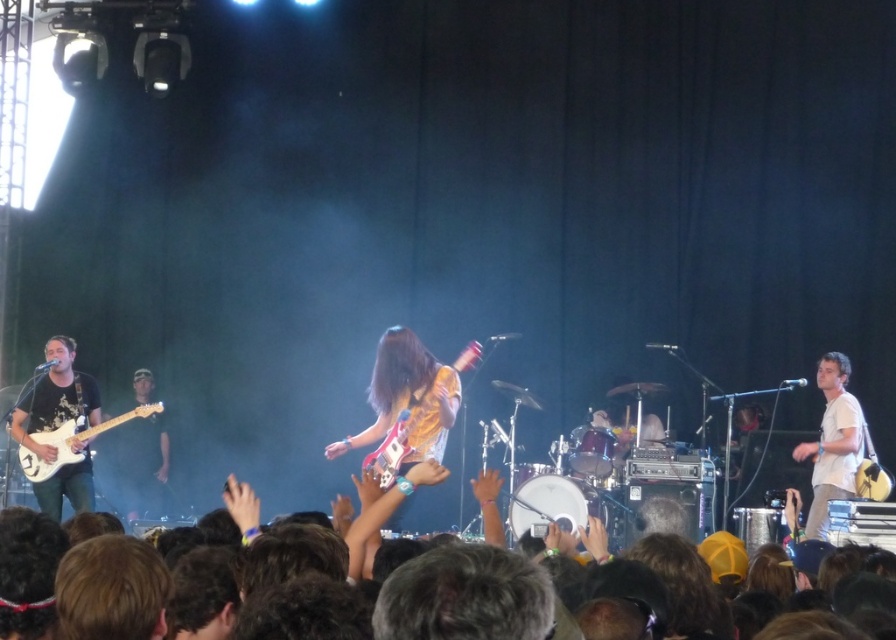
Question: Does white matte shirt at right come behind white glossy electric guitar at left?

Choices:
 (A) no
 (B) yes

Answer: (A)

Question: Estimate the real-world distances between objects in this image. Which object is closer to the white glossy electric guitar at left?

Choices:
 (A) white matte shirt at right
 (B) yellow fabric guitar at center

Answer: (B)

Question: Can you confirm if shiny metallic guitar at center is positioned above white matte shirt at right?

Choices:
 (A) yes
 (B) no

Answer: (A)

Question: Among these objects, which one is nearest to the camera?

Choices:
 (A) yellow fabric guitar at center
 (B) white glossy electric guitar at left

Answer: (A)

Question: Is yellow fabric guitar at center bigger than white matte shirt at right?

Choices:
 (A) yes
 (B) no

Answer: (A)

Question: Which point is closer to the camera taking this photo?

Choices:
 (A) (96, 396)
 (B) (381, 346)
 (C) (164, 460)

Answer: (B)